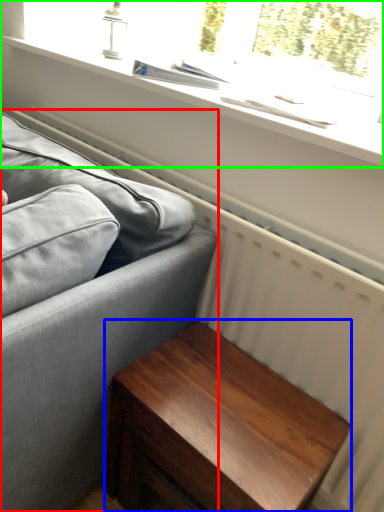
Question: Considering the real-world distances, which object is farthest from studio couch (highlighted by a red box)? table (highlighted by a blue box) or window (highlighted by a green box)?

Choices:
 (A) table
 (B) window

Answer: (B)